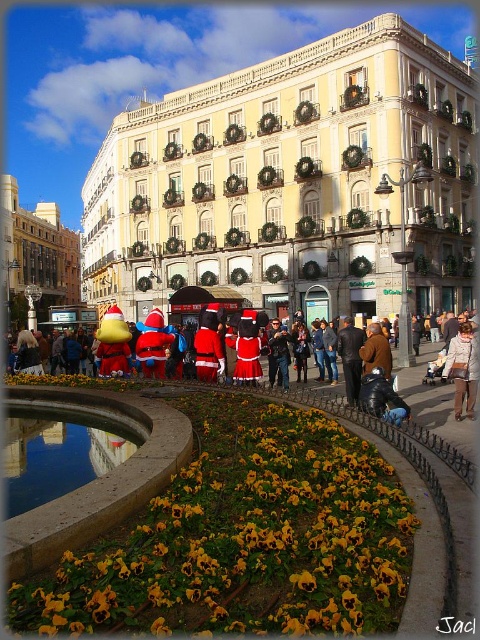
You are a fashion designer observing the scene and want to place a new accessory between the light brown leather jacket at lower right and the dark blue leather jacket at lower center. Which jacket should the accessory be closer to if it needs to be placed closer to the taller one?

The light brown leather jacket at lower right is taller than the dark blue leather jacket at lower center, so the accessory should be placed closer to the light brown leather jacket at lower right.

Looking at this image, you are a photographer standing in front of the ornate building with the cream colored facade. You want to take a photo that includes both the santa costume at center and the light brown leather jacket at lower right. Which object should you ensure is placed higher in the frame to avoid being blocked by the other?

You should ensure the santa costume at center is placed higher in the frame because it is much taller than the light brown leather jacket at lower right, so positioning it higher will prevent it from blocking the jacket below.

You are a pedestrian standing in front of the ornate building and see both the dark blue leather jacket at lower center and the brown leather jacket at center. Which jacket is positioned to the left when facing the building?

The dark blue leather jacket at lower center is positioned to the left of the brown leather jacket at center.